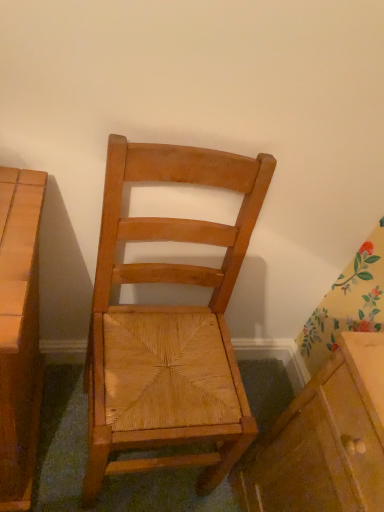
Question: In terms of height, does matte wood cabinet at lower right look taller or shorter compared to natural wood chair at center?

Choices:
 (A) tall
 (B) short

Answer: (B)

Question: Is matte wood cabinet at lower right inside or outside of natural wood chair at center?

Choices:
 (A) inside
 (B) outside

Answer: (B)

Question: Based on their sizes in the image, would you say matte wood cabinet at lower right is bigger or smaller than natural wood chair at center?

Choices:
 (A) small
 (B) big

Answer: (A)

Question: Is point (226, 360) positioned closer to the camera than point (321, 398)?

Choices:
 (A) closer
 (B) farther

Answer: (B)

Question: Is natural wood chair at center inside or outside of matte wood cabinet at lower right?

Choices:
 (A) inside
 (B) outside

Answer: (B)

Question: From a real-world perspective, is natural wood chair at center physically located above or below matte wood cabinet at lower right?

Choices:
 (A) above
 (B) below

Answer: (A)

Question: Relative to matte wood cabinet at lower right, is natural wood chair at center in front or behind?

Choices:
 (A) front
 (B) behind

Answer: (A)